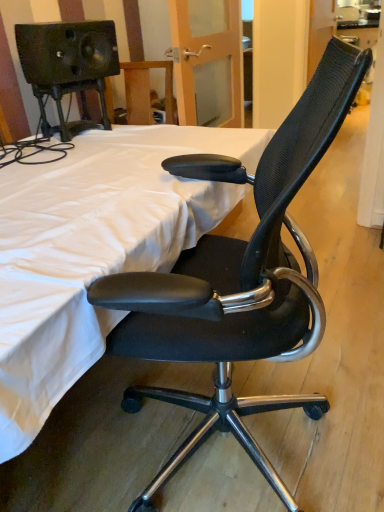
Question: Considering the positions of white fabric bed at center and black mesh office chair at center in the image, is white fabric bed at center bigger or smaller than black mesh office chair at center?

Choices:
 (A) small
 (B) big

Answer: (B)

Question: Looking at their shapes, would you say white fabric bed at center is wider or thinner than black mesh office chair at center?

Choices:
 (A) thin
 (B) wide

Answer: (B)

Question: Would you say white fabric bed at center is inside or outside black mesh office chair at center?

Choices:
 (A) inside
 (B) outside

Answer: (B)

Question: Considering the positions of point (196, 352) and point (236, 200), is point (196, 352) closer or farther from the camera than point (236, 200)?

Choices:
 (A) farther
 (B) closer

Answer: (B)

Question: From the image's perspective, is black mesh office chair at center located above or below white fabric bed at center?

Choices:
 (A) above
 (B) below

Answer: (B)

Question: Would you say black mesh office chair at center is inside or outside white fabric bed at center?

Choices:
 (A) outside
 (B) inside

Answer: (A)

Question: Based on their positions, is black mesh office chair at center located to the left or right of white fabric bed at center?

Choices:
 (A) right
 (B) left

Answer: (A)